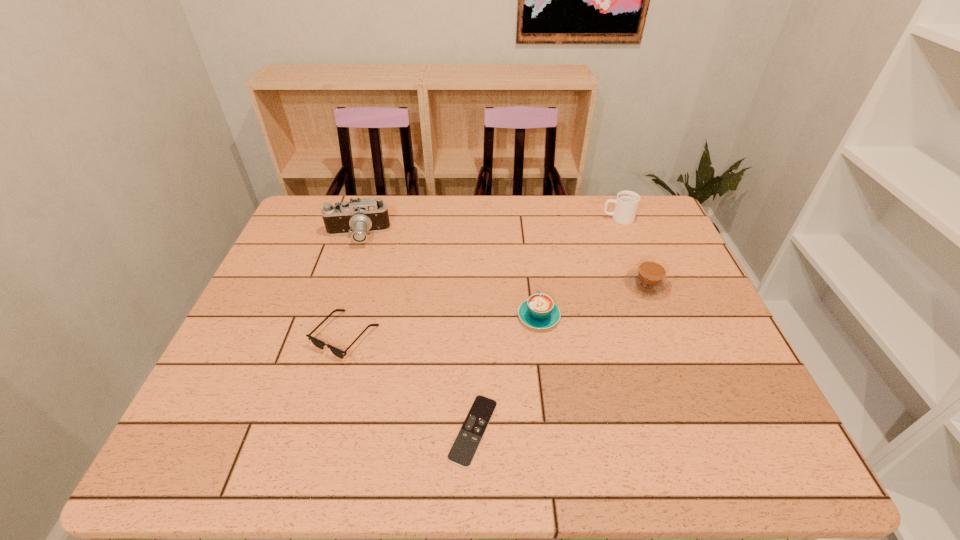
What are the coordinates of `free region located 0.250m at the lens of the tallest object` in the screenshot? It's located at (332, 310).

At what (x,y) coordinates should I click in order to perform the action: click on free space located 0.290m on the side with the handle of the tallest cappuccino. Please return your answer as a coordinate pair (x, y). The width and height of the screenshot is (960, 540). Looking at the image, I should click on (513, 219).

Find the location of a particular element. This screenshot has width=960, height=540. vacant space located on the side with the handle of the tallest cappuccino is located at coordinates (489, 219).

Identify the location of vacant space situated on the side with the handle of the tallest cappuccino. This screenshot has width=960, height=540. (564, 219).

In order to click on free space located 0.330m on the back of the fourth shortest object in this screenshot , I will do `click(615, 204)`.

Find the location of a particular element. free point located with the handle on the right side of the shortest cappuccino is located at coordinates (535, 286).

Find the location of a particular element. free region located 0.230m with the handle on the right side of the shortest cappuccino is located at coordinates (530, 246).

At what (x,y) coordinates should I click in order to perform the action: click on vacant space situated with the handle on the right side of the shortest cappuccino. Please return your answer as a coordinate pair (x, y). Looking at the image, I should click on (531, 255).

Find the location of a particular element. This screenshot has height=540, width=960. vacant space located 0.170m on the lenses of the sunglasses is located at coordinates (318, 432).

Find the location of `free space located 0.100m on the right of the remote control`. free space located 0.100m on the right of the remote control is located at coordinates (546, 430).